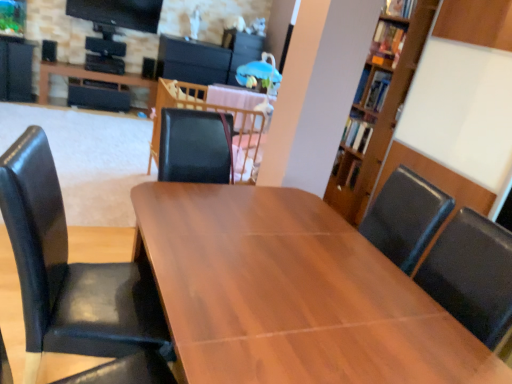
The image size is (512, 384). Describe the element at coordinates (246, 210) in the screenshot. I see `wooden table at center, the third table positioned from the top` at that location.

At what (x,y) coordinates should I click in order to perform the action: click on matte black table at upper left, placed as the 1th table when sorted from back to front. Please return your answer as a coordinate pair (x, y). Image resolution: width=512 pixels, height=384 pixels. Looking at the image, I should click on (90, 78).

I want to click on black leather chair at left, so click(x=71, y=272).

Is wooden table at center, placed as the first table when sorted from right to left, a part of matte black speaker at upper left, arranged as the second speaker when viewed from the right?

That's incorrect, wooden table at center, placed as the first table when sorted from right to left, is not inside matte black speaker at upper left, arranged as the second speaker when viewed from the right.

Is matte black speaker at upper left, the 2th speaker viewed from the back, touching wooden table at center, the third table positioned from the top?

No, matte black speaker at upper left, the 2th speaker viewed from the back, is not in contact with wooden table at center, the third table positioned from the top.

From a real-world perspective, which table is the 1st one underneath the matte black speaker at upper left, which is the first speaker from front to back? Please provide its 2D coordinates.

[(246, 210)]

From a real-world perspective, is matte black speaker at upper left, which is the first speaker from front to back, on wooden table at center, the third table positioned from the top?

Correct, in the physical world, matte black speaker at upper left, which is the first speaker from front to back, is higher than wooden table at center, the third table positioned from the top.

Is wooden table at center, the 2th table in the top-to-bottom sequence, to the right of black matte speaker at upper center, which appears as the second speaker when viewed from the front, from the viewer's perspective?

Indeed, wooden table at center, the 2th table in the top-to-bottom sequence, is positioned on the right side of black matte speaker at upper center, which appears as the second speaker when viewed from the front.

From a real-world perspective, is wooden table at center, the second table positioned from the back, above or below black matte speaker at upper center, which appears as the second speaker when viewed from the front?

In terms of real-world spatial position, wooden table at center, the second table positioned from the back, is above black matte speaker at upper center, which appears as the second speaker when viewed from the front.

From the image's perspective, is wooden table at center, the 2th table in the top-to-bottom sequence, above black matte speaker at upper center, marked as the 2th speaker in a left-to-right arrangement?

No, from the image's perspective, wooden table at center, the 2th table in the top-to-bottom sequence, is not on top of black matte speaker at upper center, marked as the 2th speaker in a left-to-right arrangement.

There is a wooden table at center, marked as the second table in a front-to-back arrangement. Where is `the 1st speaker above it (from the image's perspective)`? The width and height of the screenshot is (512, 384). the 1st speaker above it (from the image's perspective) is located at coordinates (148, 68).

Is wooden table at center, the first table viewed from the front, in front of black matte speaker at upper center, placed as the first speaker when sorted from right to left?

Yes, the depth of wooden table at center, the first table viewed from the front, is less than that of black matte speaker at upper center, placed as the first speaker when sorted from right to left.

Which object is positioned more to the right, wooden table at center, the third table viewed from the left, or black matte speaker at upper center, the first speaker in the back-to-front sequence?

Positioned to the right is wooden table at center, the third table viewed from the left.

What's the angular difference between wooden table at center, which appears as the third table when viewed from the back, and black matte speaker at upper center, marked as the 2th speaker in a left-to-right arrangement,'s facing directions?

They differ by 85.3 degrees in their facing directions.

Is black matte speaker at upper center, placed as the first speaker when sorted from right to left, placed right next to black leather chair at left?

black matte speaker at upper center, placed as the first speaker when sorted from right to left, and black leather chair at left are clearly separated.

Is point (146, 70) positioned in front of point (14, 161)?

No.

Looking at this image, relative to black leather chair at left, is black matte speaker at upper center, which appears as the second speaker when viewed from the front, in front or behind?

black matte speaker at upper center, which appears as the second speaker when viewed from the front, is positioned farther from the viewer than black leather chair at left.

Which object is thinner, black matte speaker at upper center, which appears as the second speaker when viewed from the front, or black leather chair at left?

Thinner between the two is black matte speaker at upper center, which appears as the second speaker when viewed from the front.

Where is `speaker lying behind the matte black speaker at upper left, which is the first speaker from front to back`? This screenshot has height=384, width=512. speaker lying behind the matte black speaker at upper left, which is the first speaker from front to back is located at coordinates (148, 68).

From a real-world perspective, which object stands above the other?

matte black speaker at upper left, the 1th speaker from the left, is physically above.

Does matte black speaker at upper left, the 2th speaker viewed from the back, have a smaller size compared to black matte speaker at upper center, which appears as the second speaker when viewed from the front?

Actually, matte black speaker at upper left, the 2th speaker viewed from the back, might be larger than black matte speaker at upper center, which appears as the second speaker when viewed from the front.

In the scene shown: What's the angular difference between matte black speaker at upper left, arranged as the second speaker when viewed from the right, and black matte speaker at upper center, which appears as the second speaker when viewed from the front,'s facing directions?

They differ by 6.26 degrees in their facing directions.

Considering the sizes of objects matte black table at upper left, the 3th table when ordered from right to left, and black leather chair at left in the image provided, who is thinner, matte black table at upper left, the 3th table when ordered from right to left, or black leather chair at left?

With smaller width is matte black table at upper left, the 3th table when ordered from right to left.

Does matte black table at upper left, marked as the 1th table in a left-to-right arrangement, have a lesser height compared to black leather chair at left?

Yes, matte black table at upper left, marked as the 1th table in a left-to-right arrangement, is shorter than black leather chair at left.

Consider the image. From the image's perspective, is matte black table at upper left, placed as the 1th table when sorted from back to front, beneath black leather chair at left?

Actually, matte black table at upper left, placed as the 1th table when sorted from back to front, appears above black leather chair at left in the image.

Does matte black table at upper left, positioned as the first table in top-to-bottom order, turn towards black leather chair at left?

Yes.

Based on the photo, does black leather chair at left have a greater height compared to matte black table at upper left, the 3th table when ordered from right to left?

Correct, black leather chair at left is much taller as matte black table at upper left, the 3th table when ordered from right to left.

Would you say matte black table at upper left, positioned as the first table in top-to-bottom order, is part of black leather chair at left's contents?

No, matte black table at upper left, positioned as the first table in top-to-bottom order, is located outside of black leather chair at left.

In terms of width, does black leather chair at left look wider or thinner when compared to matte black table at upper left, placed as the 1th table when sorted from back to front?

Considering their sizes, black leather chair at left looks broader than matte black table at upper left, placed as the 1th table when sorted from back to front.

Between black leather chair at left and matte black table at upper left, positioned as the first table in top-to-bottom order, which one appears on the left side from the viewer's perspective?

matte black table at upper left, positioned as the first table in top-to-bottom order, is more to the left.

At what (x,y) coordinates should I click in order to perform the action: click on speaker that is the 2nd object to the left of the wooden table at center, the third table positioned from the top, starting at the anchor. Please return your answer as a coordinate pair (x, y). This screenshot has height=384, width=512. Looking at the image, I should click on pos(49,51).

Which speaker is the 2nd one when counting from the back of the wooden table at center, the second table in the left-to-right sequence? Please provide its 2D coordinates.

[(148, 68)]

In the scene shown: Looking at the image, which one is located further to black leather chair at left, wooden table at center, marked as the second table in a front-to-back arrangement, or wooden table at center, the third table viewed from the left?

wooden table at center, marked as the second table in a front-to-back arrangement, lies further to black leather chair at left than the other object.

When comparing their distances from wooden table at center, the second table in the left-to-right sequence, does matte black table at upper left, the 3th table when ordered from right to left, or black leather chair at left seem further?

Among the two, matte black table at upper left, the 3th table when ordered from right to left, is located further to wooden table at center, the second table in the left-to-right sequence.

Estimate the real-world distances between objects in this image. Which object is closer to black matte speaker at upper center, the first speaker in the back-to-front sequence, wooden table at center, the second table positioned from the back, or wooden table at center, which appears as the third table when viewed from the back?

Among the two, wooden table at center, the second table positioned from the back, is located nearer to black matte speaker at upper center, the first speaker in the back-to-front sequence.

From the image, which object appears to be nearer to wooden table at center, marked as the second table in a front-to-back arrangement, wooden table at center, which appears as the third table when viewed from the back, or black leather chair at left?

Based on the image, wooden table at center, which appears as the third table when viewed from the back, appears to be nearer to wooden table at center, marked as the second table in a front-to-back arrangement.

Considering their positions, is black leather chair at left positioned closer to matte black speaker at upper left, the 2th speaker viewed from the back, than black matte speaker at upper center, which appears as the second speaker when viewed from the front?

Based on the image, black matte speaker at upper center, which appears as the second speaker when viewed from the front, appears to be nearer to matte black speaker at upper left, the 2th speaker viewed from the back.

Consider the image. Looking at the image, which one is located closer to black matte speaker at upper center, the first speaker in the back-to-front sequence, matte black table at upper left, marked as the 1th table in a left-to-right arrangement, or matte black speaker at upper left, which is the first speaker from front to back?

Among the two, matte black table at upper left, marked as the 1th table in a left-to-right arrangement, is located nearer to black matte speaker at upper center, the first speaker in the back-to-front sequence.

Estimate the real-world distances between objects in this image. Which object is further from wooden table at center, placed as the first table when sorted from right to left, matte black speaker at upper left, which is the first speaker from front to back, or matte black table at upper left, placed as the 1th table when sorted from back to front?

matte black speaker at upper left, which is the first speaker from front to back, is positioned further to the anchor wooden table at center, placed as the first table when sorted from right to left.

When comparing their distances from black matte speaker at upper center, the first speaker in the back-to-front sequence, does black leather chair at left or matte black table at upper left, the 3th table when ordered from right to left, seem further?

black leather chair at left is positioned further to the anchor black matte speaker at upper center, the first speaker in the back-to-front sequence.

The height and width of the screenshot is (384, 512). I want to click on speaker located between matte black table at upper left, marked as the 1th table in a left-to-right arrangement, and wooden table at center, the 2th table in the top-to-bottom sequence, in the left-right direction, so click(x=148, y=68).

Locate an element on the screen. This screenshot has width=512, height=384. chair between wooden table at center, acting as the 1th table starting from the bottom, and wooden table at center, which is counted as the 2th table, starting from the right, from front to back is located at coordinates (71, 272).

The width and height of the screenshot is (512, 384). In order to click on chair between wooden table at center, the first table viewed from the front, and black matte speaker at upper center, marked as the 2th speaker in a left-to-right arrangement, in the front-back direction in this screenshot , I will do `click(71, 272)`.

Where is `chair located between wooden table at center, placed as the first table when sorted from right to left, and matte black speaker at upper left, the 1th speaker from the left, in the depth direction`? chair located between wooden table at center, placed as the first table when sorted from right to left, and matte black speaker at upper left, the 1th speaker from the left, in the depth direction is located at coordinates (71, 272).